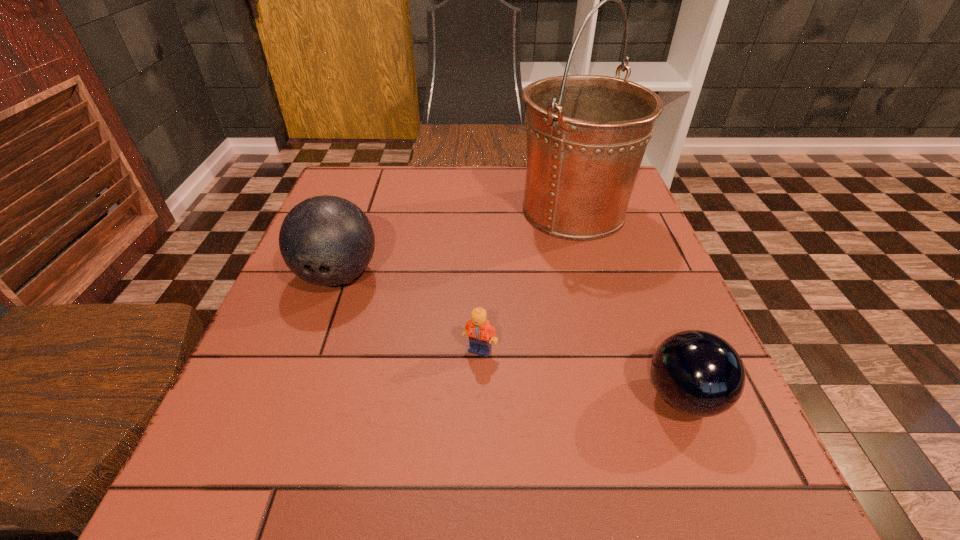
The width and height of the screenshot is (960, 540). Find the location of `free point between the nearer bowling ball and the leftmost object`. free point between the nearer bowling ball and the leftmost object is located at coordinates pos(511,336).

Where is `unoccupied position between the shortest object and the nearer bowling ball`? This screenshot has height=540, width=960. unoccupied position between the shortest object and the nearer bowling ball is located at coordinates (582, 374).

In order to click on free space between the third farthest object and the bucket in this screenshot , I will do `click(527, 280)`.

Locate an element on the screen. This screenshot has height=540, width=960. unoccupied position between the shorter bowling ball and the tallest object is located at coordinates (629, 304).

Locate an element on the screen. The image size is (960, 540). unoccupied position between the nearer bowling ball and the third farthest object is located at coordinates (582, 374).

Select which object is the third closest to the bucket. Please provide its 2D coordinates. Your answer should be formatted as a tuple, i.e. [(x, y)], where the tuple contains the x and y coordinates of a point satisfying the conditions above.

[(697, 373)]

Select which object appears as the third closest to the second object from left to right. Please provide its 2D coordinates. Your answer should be formatted as a tuple, i.e. [(x, y)], where the tuple contains the x and y coordinates of a point satisfying the conditions above.

[(586, 134)]